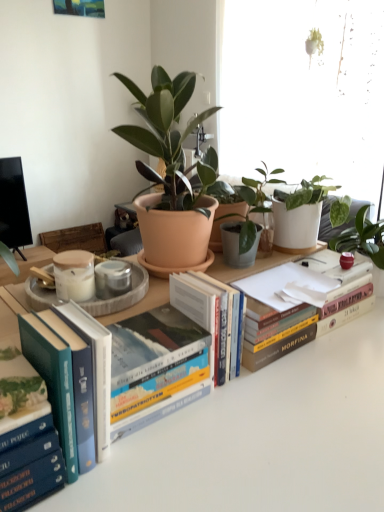
Question: Is hardcover book at center, which is the 2th book from right to left, positioned with its back to matte terracotta pot at center?

Choices:
 (A) no
 (B) yes

Answer: (A)

Question: Is hardcover book at center, placed as the 4th book when sorted from left to right, far away from matte terracotta pot at center?

Choices:
 (A) no
 (B) yes

Answer: (A)

Question: Considering the relative sizes of hardcover book at center, placed as the 4th book when sorted from left to right, and matte terracotta pot at center in the image provided, is hardcover book at center, placed as the 4th book when sorted from left to right, smaller than matte terracotta pot at center?

Choices:
 (A) no
 (B) yes

Answer: (B)

Question: Would you say hardcover book at center, which is the 2th book from right to left, is outside matte terracotta pot at center?

Choices:
 (A) yes
 (B) no

Answer: (A)

Question: Would you say matte terracotta pot at center is part of hardcover book at center, placed as the 4th book when sorted from left to right,'s contents?

Choices:
 (A) yes
 (B) no

Answer: (B)

Question: From a real-world perspective, is matte terracotta pot at center above or below hardcover book at center, which is the 2th book from right to left?

Choices:
 (A) above
 (B) below

Answer: (A)

Question: Is matte terracotta pot at center in front of or behind hardcover book at center, which is the 2th book from right to left, in the image?

Choices:
 (A) behind
 (B) front

Answer: (B)

Question: In terms of width, does matte terracotta pot at center look wider or thinner when compared to hardcover book at center, which is the 2th book from right to left?

Choices:
 (A) thin
 (B) wide

Answer: (B)

Question: Considering the relative positions of matte terracotta pot at center and hardcover book at center, which is the 2th book from right to left, in the image provided, is matte terracotta pot at center to the left or to the right of hardcover book at center, which is the 2th book from right to left,?

Choices:
 (A) right
 (B) left

Answer: (B)

Question: Visually, is hardcover book at center, placed as the 5th book when sorted from left to right, positioned to the left or to the right of blue hardcover book at lower left, which is the 1th book in left-to-right order?

Choices:
 (A) left
 (B) right

Answer: (B)

Question: In terms of size, does hardcover book at center, placed as the first book when sorted from right to left, appear bigger or smaller than blue hardcover book at lower left, which is the 5th book in right-to-left order?

Choices:
 (A) big
 (B) small

Answer: (A)

Question: Is point (324, 304) positioned closer to the camera than point (21, 466)?

Choices:
 (A) farther
 (B) closer

Answer: (A)

Question: Considering the positions of hardcover book at center, placed as the first book when sorted from right to left, and blue hardcover book at lower left, which is the 1th book in left-to-right order, in the image, is hardcover book at center, placed as the first book when sorted from right to left, wider or thinner than blue hardcover book at lower left, which is the 1th book in left-to-right order,?

Choices:
 (A) thin
 (B) wide

Answer: (B)

Question: Which is correct: hardcover books at left, arranged as the 2th book when viewed from the left, is inside hardcover book at center, placed as the 5th book when sorted from left to right, or outside of it?

Choices:
 (A) inside
 (B) outside

Answer: (B)

Question: In the image, is hardcover books at left, which appears as the fourth book when viewed from the right, positioned in front of or behind hardcover book at center, placed as the 5th book when sorted from left to right?

Choices:
 (A) front
 (B) behind

Answer: (A)